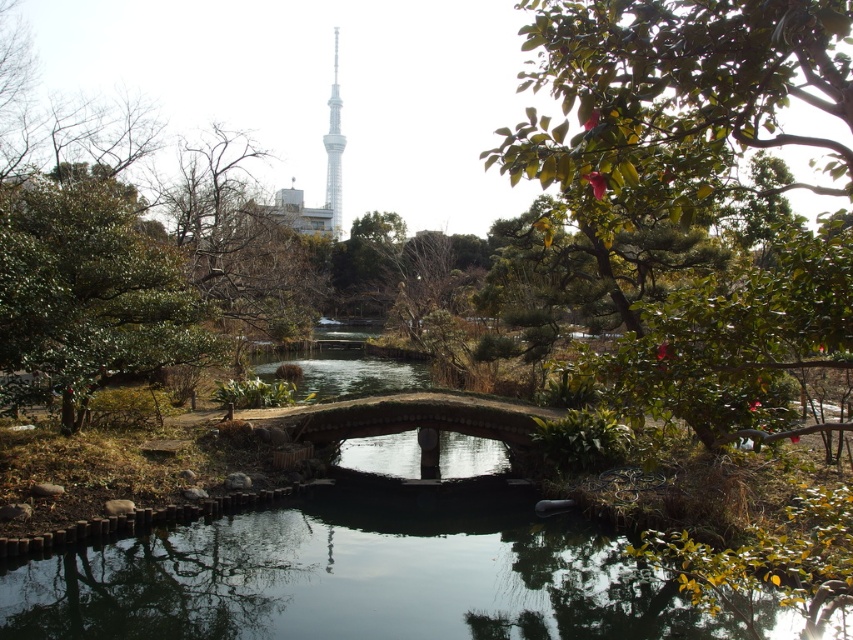
Does point (755, 417) come closer to viewer compared to point (335, 104)?

That is True.

Can you confirm if green leafy tree at center is shorter than white glassy eiffel tower at upper center?

Correct, green leafy tree at center is not as tall as white glassy eiffel tower at upper center.

Is point (834, 97) closer to viewer compared to point (328, 124)?

Yes.

You are a GUI agent. You are given a task and a screenshot of the screen. Output one action in this format:
    pyautogui.click(x=<x>, y=<y>)
    Task: Click on the green leafy tree at center
    The height and width of the screenshot is (640, 853).
    Given the screenshot: What is the action you would take?
    pyautogui.click(x=675, y=97)

Can you confirm if green leafy tree at left is wider than white glassy eiffel tower at upper center?

Yes, green leafy tree at left is wider than white glassy eiffel tower at upper center.

Looking at this image, does green leafy tree at left appear on the right side of white glassy eiffel tower at upper center?

Indeed, green leafy tree at left is positioned on the right side of white glassy eiffel tower at upper center.

This screenshot has width=853, height=640. What do you see at coordinates (103, 243) in the screenshot?
I see `green leafy tree at left` at bounding box center [103, 243].

Identify the location of green leafy tree at left. The height and width of the screenshot is (640, 853). (103, 243).

Is green leafy tree at center positioned behind green leafy tree at left?

No, it is not.

Does point (705, 195) lie in front of point (26, 225)?

Yes.

The image size is (853, 640). Identify the location of green leafy tree at center. (675, 97).